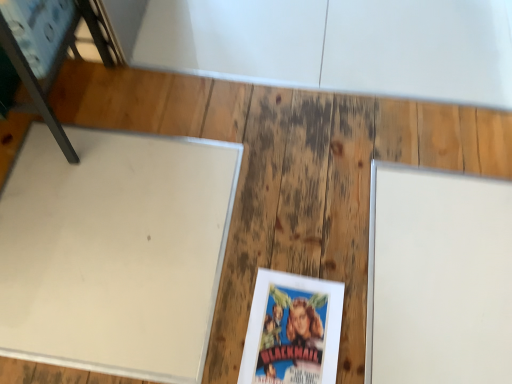
You are a GUI agent. You are given a task and a screenshot of the screen. Output one action in this format:
    pyautogui.click(x=<x>, y=<y>)
    Task: Click on the vacant location behind white matte board at right
    This screenshot has width=512, height=384.
    Given the screenshot: What is the action you would take?
    pyautogui.click(x=396, y=140)